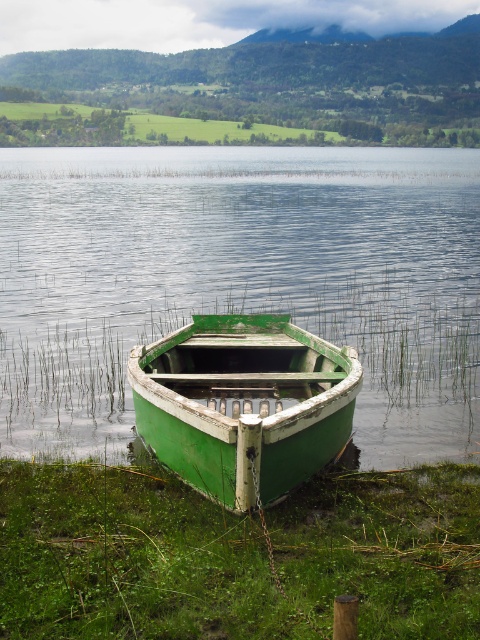
Question: Which point is farther to the camera?

Choices:
 (A) green wood boat at center
 (B) green matte boat at center
 (C) green grass at lower center

Answer: (A)

Question: Among these points, which one is farthest from the camera?

Choices:
 (A) (139, 284)
 (B) (111, 618)

Answer: (A)

Question: Is green wood boat at center above green matte boat at center?

Choices:
 (A) yes
 (B) no

Answer: (A)

Question: Does green wood boat at center appear on the right side of green grass at lower center?

Choices:
 (A) yes
 (B) no

Answer: (A)

Question: Which is nearer to the green wood boat at center?

Choices:
 (A) green grass at lower center
 (B) green matte boat at center

Answer: (A)

Question: Can you confirm if green wood boat at center is positioned below green grass at lower center?

Choices:
 (A) no
 (B) yes

Answer: (A)